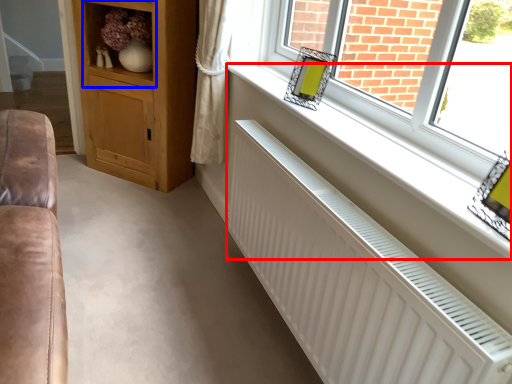
Question: Which object appears farthest to the camera in this image, window sill (highlighted by a red box) or shelf (highlighted by a blue box)?

Choices:
 (A) window sill
 (B) shelf

Answer: (B)